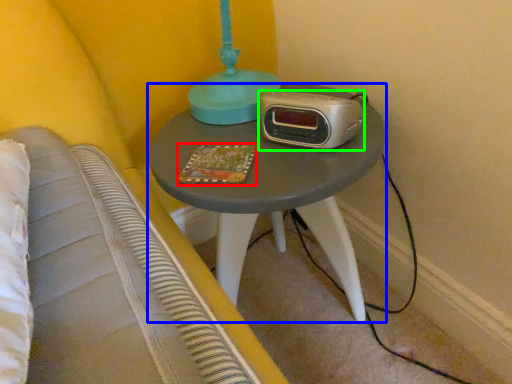
Question: Which object is the farthest from book (highlighted by a red box)? Choose among these: nightstand (highlighted by a blue box) or stereo (highlighted by a green box).

Choices:
 (A) nightstand
 (B) stereo

Answer: (A)